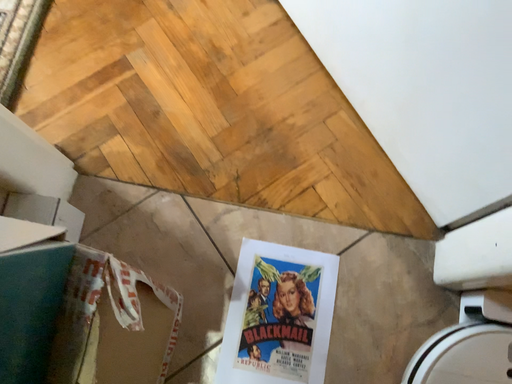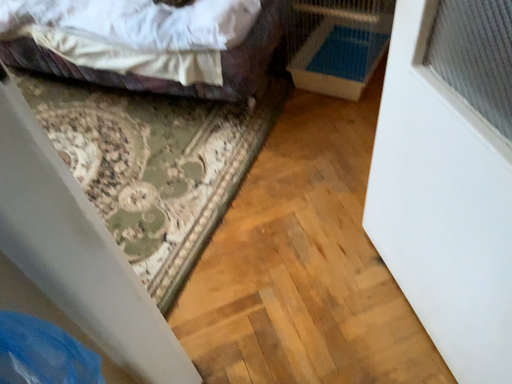
Question: Which way did the camera rotate in the video?

Choices:
 (A) rotated right
 (B) rotated left

Answer: (B)